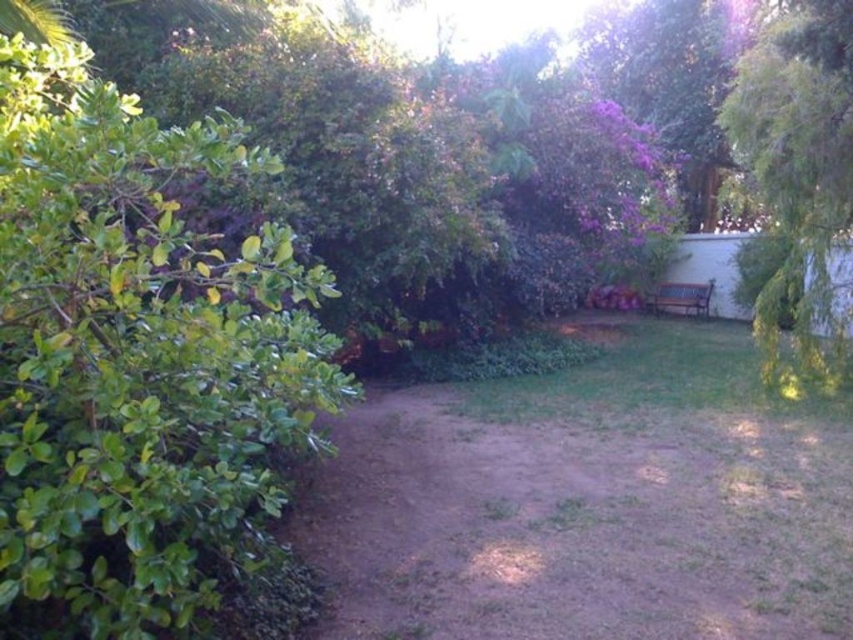
How far apart are green leafy bush at left and dirt path at center?

green leafy bush at left is 7.38 feet from dirt path at center.

Between green leafy bush at left and dirt path at center, which one has less height?

dirt path at center is shorter.

This screenshot has height=640, width=853. Identify the location of green leafy bush at left. (138, 358).

Between green leafy bush at left and green leafy tree at right, which one appears on the right side from the viewer's perspective?

green leafy tree at right

Is green leafy bush at left positioned before green leafy tree at right?

Yes, it is.

Locate an element on the screen. green leafy bush at left is located at coordinates (138, 358).

This screenshot has width=853, height=640. What are the coordinates of `green leafy bush at left` in the screenshot? It's located at (138, 358).

In the scene shown: Who is shorter, dirt path at center or green leafy tree at right?

dirt path at center

Is point (503, 552) positioned in front of point (814, 243)?

Yes, point (503, 552) is in front of point (814, 243).

Image resolution: width=853 pixels, height=640 pixels. What are the coordinates of `dirt path at center` in the screenshot? It's located at (589, 502).